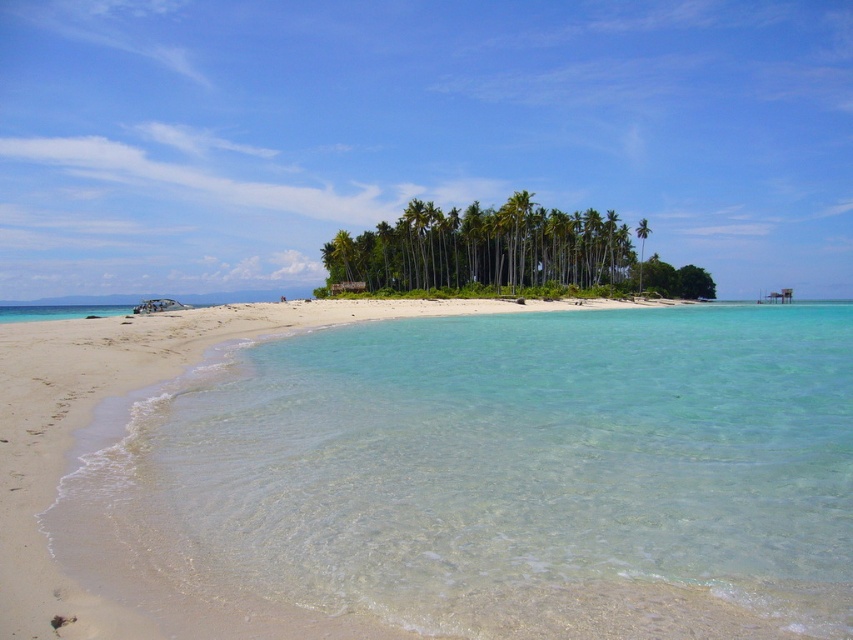
Question: Does green leafy palm trees at center have a larger size compared to green leafy palm tree at center?

Choices:
 (A) no
 (B) yes

Answer: (A)

Question: Is light beige sand at lower left bigger than green leafy palm trees at center?

Choices:
 (A) yes
 (B) no

Answer: (B)

Question: Estimate the real-world distances between objects in this image. Which object is farther from the green leafy palm trees at center?

Choices:
 (A) light beige sand at lower left
 (B) green leafy palm tree at center

Answer: (A)

Question: Does light beige sand at lower left appear over green leafy palm tree at center?

Choices:
 (A) yes
 (B) no

Answer: (B)

Question: Which object is positioned farthest from the light beige sand at lower left?

Choices:
 (A) green leafy palm trees at center
 (B) green leafy palm tree at center

Answer: (B)

Question: Estimate the real-world distances between objects in this image. Which object is closer to the light beige sand at lower left?

Choices:
 (A) green leafy palm tree at center
 (B) green leafy palm trees at center

Answer: (B)